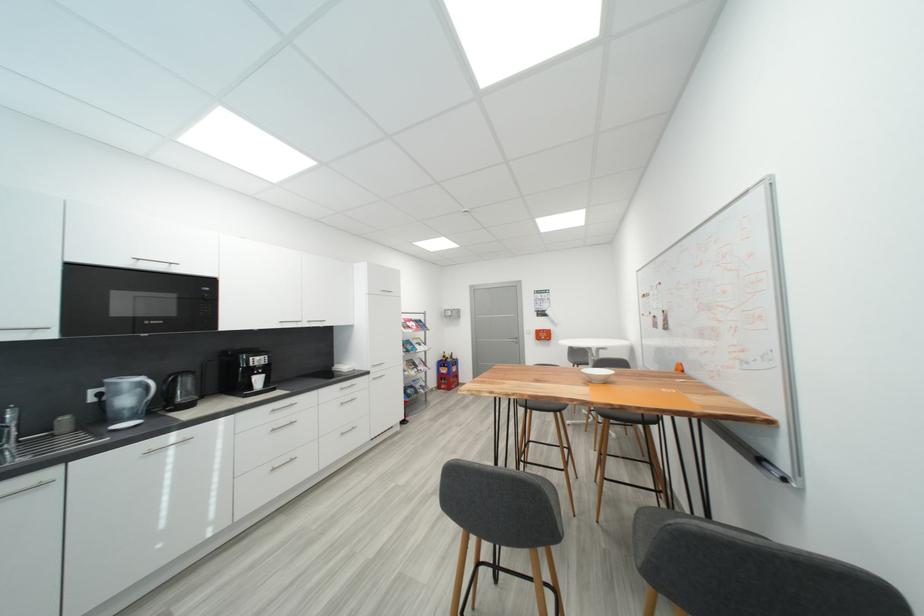
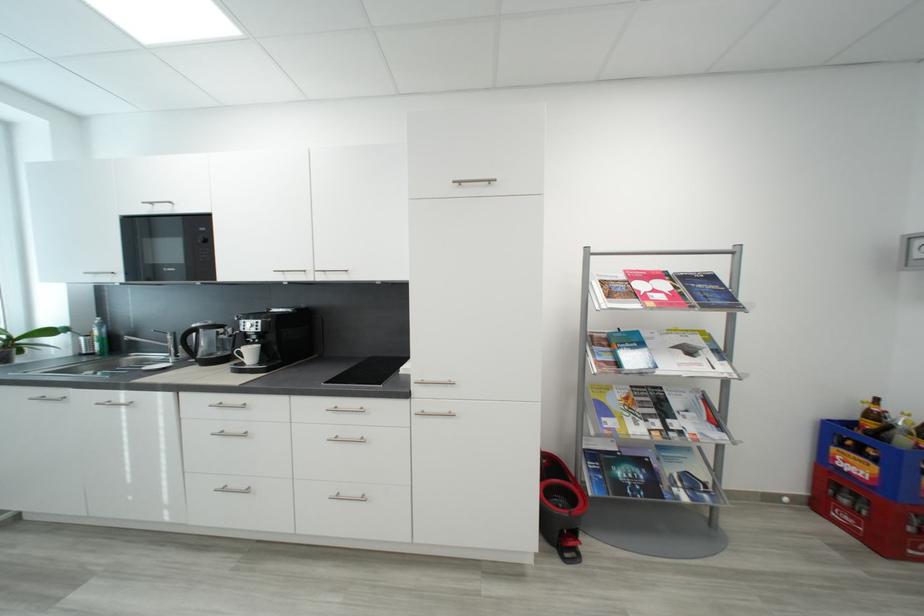
In the second image, find the point that corresponds to the point at 424,363 in the first image.

(684, 406)